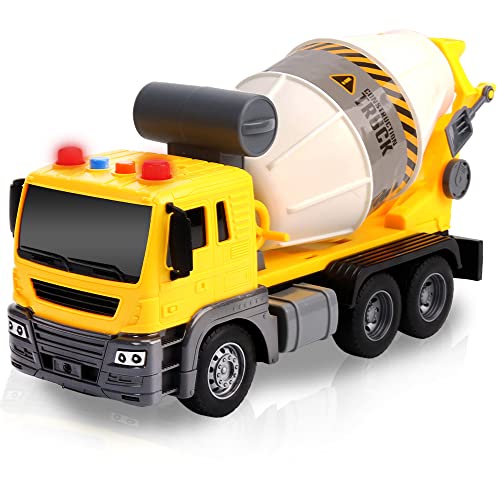
In order to click on toy in this screenshot , I will do `click(325, 243)`.